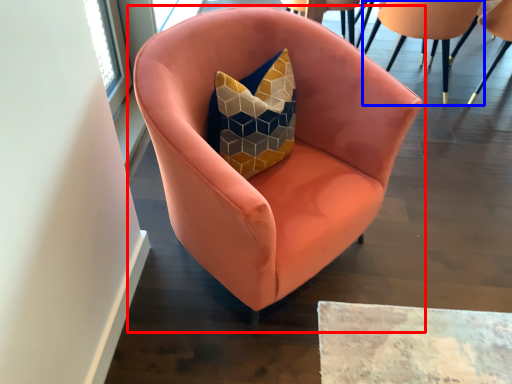
Question: Which of the following is the farthest to the observer, chair (highlighted by a red box) or chair (highlighted by a blue box)?

Choices:
 (A) chair
 (B) chair

Answer: (B)